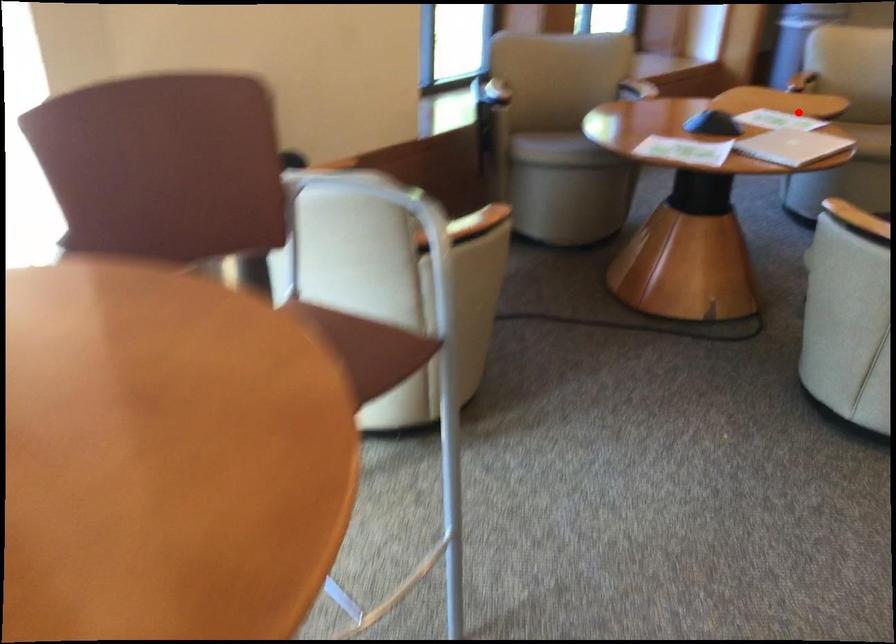
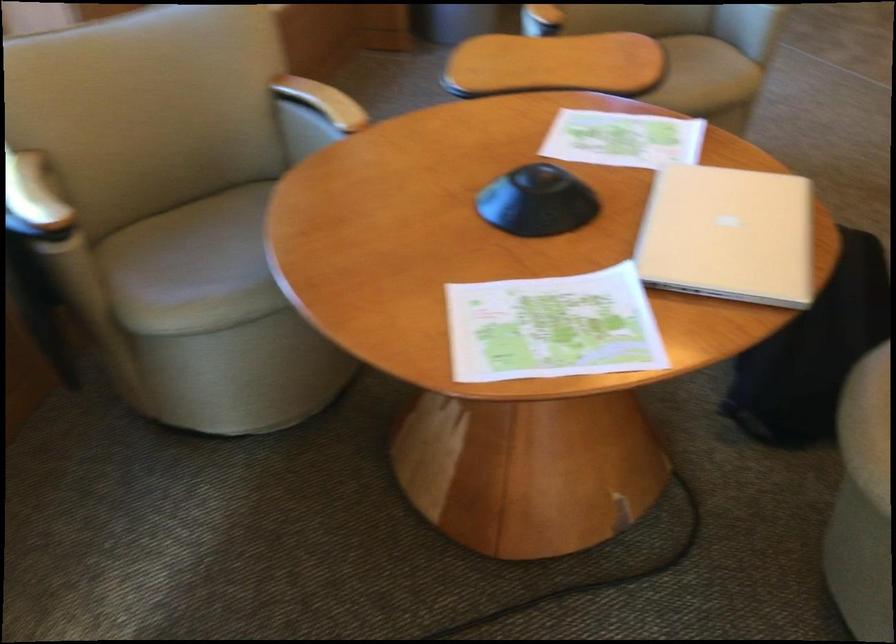
Question: A red point is marked in image1. In image2, is the corresponding 3D point closer to the camera or farther? Reply with the corresponding letter.

Choices:
 (A) The corresponding 3D point is closer.
 (B) The corresponding 3D point is farther.

Answer: (A)